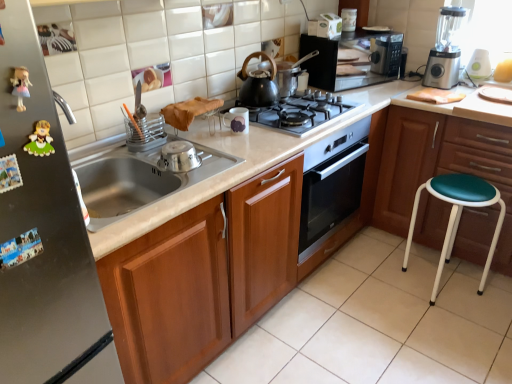
Question: Does stainless steel bowl at sink, the 1th appliance positioned from the bottom, turn towards satin silver fridge at left?

Choices:
 (A) yes
 (B) no

Answer: (B)

Question: Are stainless steel bowl at sink, the 3th appliance in the top-to-bottom sequence, and satin silver fridge at left beside each other?

Choices:
 (A) yes
 (B) no

Answer: (B)

Question: Are stainless steel bowl at sink, the third appliance when ordered from right to left, and satin silver fridge at left far apart?

Choices:
 (A) no
 (B) yes

Answer: (A)

Question: Is the position of stainless steel bowl at sink, the third appliance when ordered from right to left, more distant than that of satin silver fridge at left?

Choices:
 (A) yes
 (B) no

Answer: (A)

Question: From a real-world perspective, is stainless steel bowl at sink, placed as the first appliance when sorted from left to right, located beneath satin silver fridge at left?

Choices:
 (A) yes
 (B) no

Answer: (B)

Question: Choose the correct answer: Is white glossy countertop at center inside white glossy mug at upper center, the 2th appliance when ordered from front to back, or outside it?

Choices:
 (A) inside
 (B) outside

Answer: (B)

Question: Does point (497, 327) appear closer or farther from the camera than point (247, 117)?

Choices:
 (A) farther
 (B) closer

Answer: (A)

Question: Considering the positions of white glossy countertop at center and white glossy mug at upper center, which appears as the 2th appliance when viewed from the back, in the image, is white glossy countertop at center taller or shorter than white glossy mug at upper center, which appears as the 2th appliance when viewed from the back,?

Choices:
 (A) short
 (B) tall

Answer: (B)

Question: From a real-world perspective, relative to white glossy mug at upper center, placed as the second appliance when sorted from left to right, is white glossy countertop at center vertically above or below?

Choices:
 (A) above
 (B) below

Answer: (B)

Question: In terms of size, does black matte tea pot at center appear bigger or smaller than green plastic blender at upper right, which is the first appliance in right-to-left order?

Choices:
 (A) small
 (B) big

Answer: (B)

Question: From the image's perspective, is black matte tea pot at center above or below green plastic blender at upper right, the first appliance viewed from the back?

Choices:
 (A) above
 (B) below

Answer: (B)

Question: From a real-world perspective, is black matte tea pot at center physically located above or below green plastic blender at upper right, marked as the 3th appliance in a left-to-right arrangement?

Choices:
 (A) below
 (B) above

Answer: (B)

Question: In the image, is black matte tea pot at center positioned in front of or behind green plastic blender at upper right, the 3th appliance in the front-to-back sequence?

Choices:
 (A) behind
 (B) front

Answer: (B)

Question: From the image's perspective, relative to green leather stool at right, is green plastic blender at upper right, the first appliance viewed from the back, above or below?

Choices:
 (A) below
 (B) above

Answer: (B)

Question: Does point (472, 64) appear closer or farther from the camera than point (380, 187)?

Choices:
 (A) farther
 (B) closer

Answer: (B)